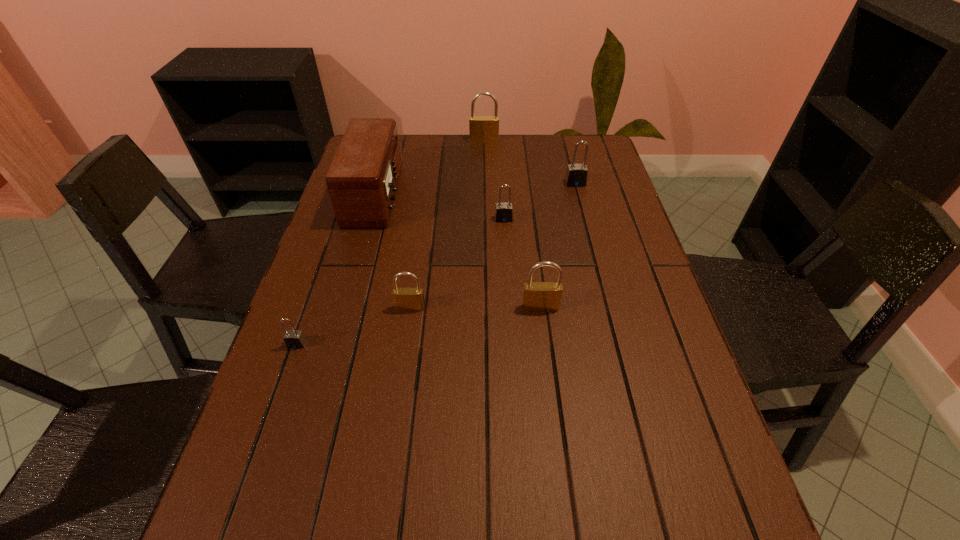
Point out which padlock is positioned as the fifth nearest to the second biggest gray padlock. Please provide its 2D coordinates. Your answer should be formatted as a tuple, i.e. [(x, y)], where the tuple contains the x and y coordinates of a point satisfying the conditions above.

[(293, 339)]

Find the location of `brass padlock that is the nearest to the leftmost brass padlock`. brass padlock that is the nearest to the leftmost brass padlock is located at coordinates (537, 296).

Identify the location of the closest brass padlock to the farthest brass padlock. (537, 296).

This screenshot has width=960, height=540. I want to click on gray padlock that stands as the closest to the second biggest gray padlock, so click(576, 175).

Choose which gray padlock is the nearest neighbor to the second padlock from left to right. Please provide its 2D coordinates. Your answer should be formatted as a tuple, i.e. [(x, y)], where the tuple contains the x and y coordinates of a point satisfying the conditions above.

[(293, 339)]

You are a GUI agent. You are given a task and a screenshot of the screen. Output one action in this format:
    pyautogui.click(x=<x>, y=<y>)
    Task: Click on the free space that satisfies the following two spatial constraints: 1. on the front-facing side of the radio receiver; 2. on the shackle of the nearest gray padlock
    Image resolution: width=960 pixels, height=540 pixels.
    Given the screenshot: What is the action you would take?
    pyautogui.click(x=335, y=345)